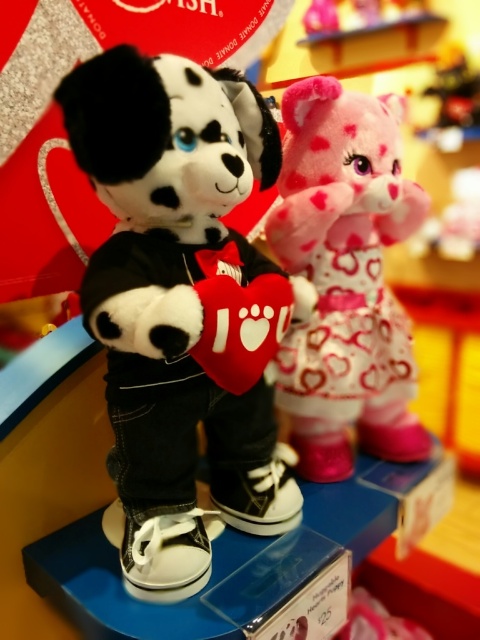
You are a customer in the store and want to take a closer look at the two points on the shelf. Which point, point (252, 364) or point (300, 180), is nearer to you?

Point (252, 364) is closer to the camera than point (300, 180), so it is nearer to you.

You are a store employee arranging the shelf. You need to place a new small box that is 10 cm wide between the soft plush dog at center and the fluffy pink plush at upper right. Can the space between them accommodate the box?

The soft plush dog at center is larger in size than the fluffy pink plush at upper right, but the exact distance between them isn answer the question. Please provide the distance between the two plush toys to determine if the box can fit.